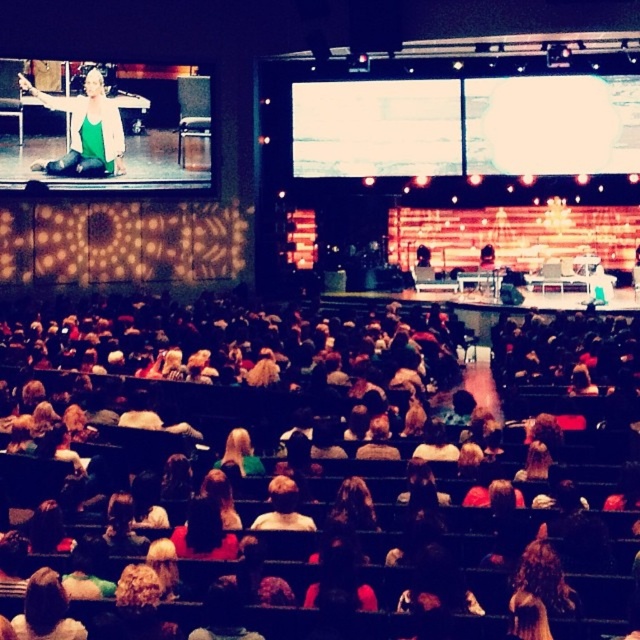
Question: Does green matte tank top at upper left have a smaller size compared to blonde hair at center?

Choices:
 (A) no
 (B) yes

Answer: (A)

Question: From the image, what is the correct spatial relationship of green matte tank top at upper left in relation to blonde hair at center?

Choices:
 (A) above
 (B) below

Answer: (A)

Question: Which point is closer to the camera?

Choices:
 (A) (115, 141)
 (B) (228, 451)

Answer: (B)

Question: Does green matte tank top at upper left have a greater width compared to blonde hair at center?

Choices:
 (A) no
 (B) yes

Answer: (B)

Question: Which point is farther to the camera?

Choices:
 (A) green matte tank top at upper left
 (B) blonde hair at center

Answer: (A)